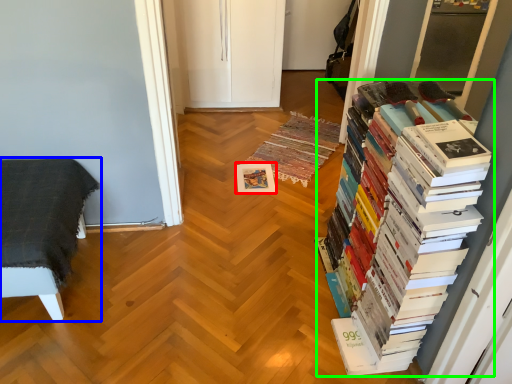
Question: Estimate the real-world distances between objects in this image. Which object is closer to paperback book (highlighted by a red box), furniture (highlighted by a blue box) or book (highlighted by a green box)?

Choices:
 (A) furniture
 (B) book

Answer: (A)